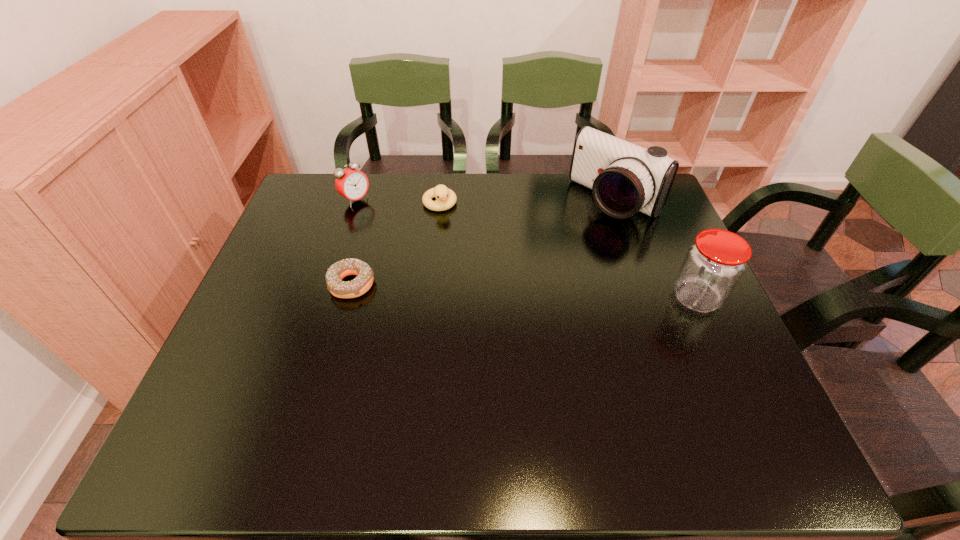
At what (x,y) coordinates should I click in order to perform the action: click on the shortest object. Please return your answer as a coordinate pair (x, y). Looking at the image, I should click on (362, 283).

At what (x,y) coordinates should I click in order to perform the action: click on jar. Please return your answer as a coordinate pair (x, y). Looking at the image, I should click on (714, 264).

The width and height of the screenshot is (960, 540). Find the location of `the third tallest object`. the third tallest object is located at coordinates (353, 184).

Locate an element on the screen. camcorder is located at coordinates (625, 178).

The image size is (960, 540). I want to click on duckling, so click(445, 198).

Image resolution: width=960 pixels, height=540 pixels. What are the coordinates of `the fourth tallest object` in the screenshot? It's located at (445, 198).

At what (x,y) coordinates should I click in order to perform the action: click on vacant space located on the left of the shortest object. Please return your answer as a coordinate pair (x, y). The image size is (960, 540). Looking at the image, I should click on (266, 284).

Locate an element on the screen. This screenshot has height=540, width=960. vacant area located on the back of the jar is located at coordinates (658, 213).

The height and width of the screenshot is (540, 960). I want to click on free point located on the front-facing side of the third shortest object, so click(x=401, y=231).

Where is `free space located on the front-facing side of the third shortest object`? The width and height of the screenshot is (960, 540). free space located on the front-facing side of the third shortest object is located at coordinates (448, 261).